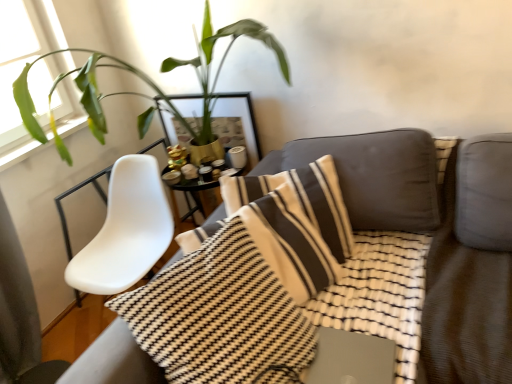
The height and width of the screenshot is (384, 512). In order to click on gold metallic picture frame at upper center in this screenshot , I will do `click(237, 124)`.

The image size is (512, 384). What do you see at coordinates (237, 124) in the screenshot?
I see `gold metallic picture frame at upper center` at bounding box center [237, 124].

What do you see at coordinates (147, 84) in the screenshot?
I see `green leafy plant at upper left` at bounding box center [147, 84].

Describe the element at coordinates (351, 358) in the screenshot. The width and height of the screenshot is (512, 384). I see `metallic silver laptop at center` at that location.

What is the approximate height of metallic silver laptop at center?

The height of metallic silver laptop at center is 5.40 centimeters.

At what (x,y) coordinates should I click in order to perform the action: click on textured gray couch at center. Please return your answer as a coordinate pair (x, y). Image resolution: width=512 pixels, height=384 pixels. Looking at the image, I should click on (433, 239).

What is the approximate width of textured gray couch at center?

textured gray couch at center is 1.61 meters wide.

You are a GUI agent. You are given a task and a screenshot of the screen. Output one action in this format:
    pyautogui.click(x=<x>, y=<y>)
    Task: Click on the gold metallic picture frame at upper center
    
    Given the screenshot: What is the action you would take?
    pyautogui.click(x=237, y=124)

From a real-world perspective, is textured gray couch at center physically below green leafy plant at upper left?

Yes, from a real-world perspective, textured gray couch at center is beneath green leafy plant at upper left.

Would you say green leafy plant at upper left is part of textured gray couch at center's contents?

No, green leafy plant at upper left is located outside of textured gray couch at center.

Is textured gray couch at center further to camera compared to green leafy plant at upper left?

No, the depth of textured gray couch at center is less than that of green leafy plant at upper left.

Does green leafy plant at upper left have a greater height compared to gold metallic picture frame at upper center?

Yes.

Which of these two, green leafy plant at upper left or gold metallic picture frame at upper center, is wider?

green leafy plant at upper left.

From a real-world perspective, who is located higher, green leafy plant at upper left or gold metallic picture frame at upper center?

From a 3D spatial view, green leafy plant at upper left is above.

Looking at this image, from the image's perspective, which one is positioned higher, green leafy plant at upper left or gold metallic picture frame at upper center?

green leafy plant at upper left appears higher in the image.

Is gold metallic picture frame at upper center next to metallic silver laptop at center?

There is a gap between gold metallic picture frame at upper center and metallic silver laptop at center.

From the image's perspective, is gold metallic picture frame at upper center above metallic silver laptop at center?

Yes, from the image's perspective, gold metallic picture frame at upper center is on top of metallic silver laptop at center.

From a real-world perspective, is gold metallic picture frame at upper center located higher than metallic silver laptop at center?

Correct, in the physical world, gold metallic picture frame at upper center is higher than metallic silver laptop at center.

Considering the positions of objects textured gray couch at center and gold metallic picture frame at upper center in the image provided, who is in front, textured gray couch at center or gold metallic picture frame at upper center?

textured gray couch at center is closer to the camera.

Looking at the image, does textured gray couch at center seem bigger or smaller compared to gold metallic picture frame at upper center?

In the image, textured gray couch at center appears to be larger than gold metallic picture frame at upper center.

From the image's perspective, is textured gray couch at center located above gold metallic picture frame at upper center?

No, from the image's perspective, textured gray couch at center is not on top of gold metallic picture frame at upper center.

In the image, is metallic silver laptop at center on the left side or the right side of green leafy plant at upper left?

Clearly, metallic silver laptop at center is on the right of green leafy plant at upper left in the image.

From a real-world perspective, which object stands above the other?

From a 3D spatial view, green leafy plant at upper left is above.

Is metallic silver laptop at center bigger than green leafy plant at upper left?

Incorrect, metallic silver laptop at center is not larger than green leafy plant at upper left.

Considering the relative sizes of metallic silver laptop at center and green leafy plant at upper left in the image provided, is metallic silver laptop at center wider than green leafy plant at upper left?

No, metallic silver laptop at center is not wider than green leafy plant at upper left.

Is textured gray couch at center located within green leafy plant at upper left?

Definitely not — textured gray couch at center is not inside green leafy plant at upper left.

Between green leafy plant at upper left and textured gray couch at center, which one has more height?

With more height is textured gray couch at center.

From the image's perspective, between green leafy plant at upper left and textured gray couch at center, which one is located above?

green leafy plant at upper left is shown above in the image.

Is green leafy plant at upper left outside of metallic silver laptop at center?

Yes.

Which is more to the right, green leafy plant at upper left or metallic silver laptop at center?

From the viewer's perspective, metallic silver laptop at center appears more on the right side.

Is green leafy plant at upper left beside metallic silver laptop at center?

No.

You are a GUI agent. You are given a task and a screenshot of the screen. Output one action in this format:
    pyautogui.click(x=<x>, y=<y>)
    Task: Click on the houseplant positioned vertically above the textured gray couch at center (from a real-world perspective)
    
    Given the screenshot: What is the action you would take?
    pyautogui.click(x=147, y=84)

Where is `houseplant on the left of gold metallic picture frame at upper center`? houseplant on the left of gold metallic picture frame at upper center is located at coordinates coord(147,84).

Consider the image. Estimate the real-world distances between objects in this image. Which object is further from green leafy plant at upper left, metallic silver laptop at center or textured gray couch at center?

metallic silver laptop at center.

Which object lies further to the anchor point metallic silver laptop at center, textured gray couch at center or gold metallic picture frame at upper center?

gold metallic picture frame at upper center is further to metallic silver laptop at center.

From the image, which object appears to be nearer to green leafy plant at upper left, textured gray couch at center or gold metallic picture frame at upper center?

Based on the image, gold metallic picture frame at upper center appears to be nearer to green leafy plant at upper left.

Estimate the real-world distances between objects in this image. Which object is closer to green leafy plant at upper left, gold metallic picture frame at upper center or textured gray couch at center?

The object closer to green leafy plant at upper left is gold metallic picture frame at upper center.

When comparing their distances from metallic silver laptop at center, does gold metallic picture frame at upper center or green leafy plant at upper left seem further?

Among the two, green leafy plant at upper left is located further to metallic silver laptop at center.

Looking at the image, which one is located closer to gold metallic picture frame at upper center, textured gray couch at center or green leafy plant at upper left?

green leafy plant at upper left.

When comparing their distances from green leafy plant at upper left, does textured gray couch at center or metallic silver laptop at center seem further?

metallic silver laptop at center is positioned further to the anchor green leafy plant at upper left.

Based on the photo, considering their positions, is metallic silver laptop at center positioned further to green leafy plant at upper left than gold metallic picture frame at upper center?

metallic silver laptop at center lies further to green leafy plant at upper left than the other object.

The width and height of the screenshot is (512, 384). Find the location of `studio couch that lies between green leafy plant at upper left and metallic silver laptop at center from top to bottom`. studio couch that lies between green leafy plant at upper left and metallic silver laptop at center from top to bottom is located at coordinates (433, 239).

You are a GUI agent. You are given a task and a screenshot of the screen. Output one action in this format:
    pyautogui.click(x=<x>, y=<y>)
    Task: Click on the houseplant positioned between textured gray couch at center and gold metallic picture frame at upper center from near to far
    The width and height of the screenshot is (512, 384).
    Given the screenshot: What is the action you would take?
    pyautogui.click(x=147, y=84)

This screenshot has height=384, width=512. Find the location of `computer between textured gray couch at center and gold metallic picture frame at upper center along the z-axis`. computer between textured gray couch at center and gold metallic picture frame at upper center along the z-axis is located at coordinates (351, 358).

At what (x,y) coordinates should I click in order to perform the action: click on houseplant between metallic silver laptop at center and gold metallic picture frame at upper center from front to back. Please return your answer as a coordinate pair (x, y). The image size is (512, 384). Looking at the image, I should click on (147, 84).